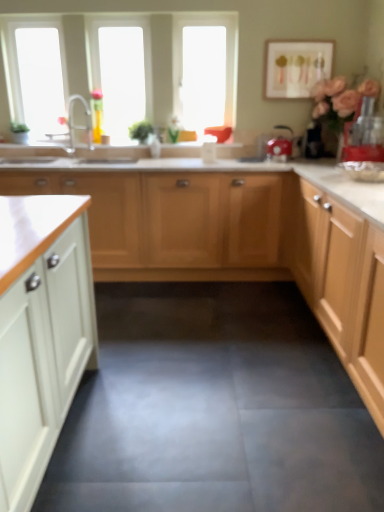
Question: From a real-world perspective, is red plastic blender at right, which appears as the 1th appliance when viewed from the right, located higher than transparent glass window at upper left, which appears as the 2th window screen when viewed from the right?

Choices:
 (A) no
 (B) yes

Answer: (A)

Question: Considering the relative sizes of red plastic blender at right, which appears as the 2th appliance when viewed from the left, and transparent glass window at upper left, which appears as the first window screen when viewed from the left, in the image provided, is red plastic blender at right, which appears as the 2th appliance when viewed from the left, taller than transparent glass window at upper left, which appears as the first window screen when viewed from the left,?

Choices:
 (A) no
 (B) yes

Answer: (A)

Question: Is the position of red plastic blender at right, acting as the second appliance starting from the back, more distant than that of transparent glass window at upper left, which appears as the 2th window screen when viewed from the right?

Choices:
 (A) no
 (B) yes

Answer: (A)

Question: Considering the relative positions of red plastic blender at right, which appears as the 2th appliance when viewed from the left, and transparent glass window at upper left, which appears as the first window screen when viewed from the left, in the image provided, is red plastic blender at right, which appears as the 2th appliance when viewed from the left, to the left of transparent glass window at upper left, which appears as the first window screen when viewed from the left, from the viewer's perspective?

Choices:
 (A) no
 (B) yes

Answer: (A)

Question: From the image's perspective, would you say red plastic blender at right, acting as the second appliance starting from the back, is shown under transparent glass window at upper left, which appears as the 2th window screen when viewed from the right?

Choices:
 (A) yes
 (B) no

Answer: (A)

Question: Could you tell me if red plastic blender at right, which appears as the 1th appliance when viewed from the right, is facing transparent glass window at upper left, which appears as the first window screen when viewed from the left?

Choices:
 (A) yes
 (B) no

Answer: (B)

Question: From a real-world perspective, does red plastic blender at right, which appears as the 2th appliance when viewed from the left, stand above transparent plastic window screen at upper center, the 1th window screen positioned from the right?

Choices:
 (A) no
 (B) yes

Answer: (A)

Question: Considering the relative sizes of red plastic blender at right, acting as the second appliance starting from the back, and transparent plastic window screen at upper center, the second window screen viewed from the left, in the image provided, is red plastic blender at right, acting as the second appliance starting from the back, smaller than transparent plastic window screen at upper center, the second window screen viewed from the left,?

Choices:
 (A) no
 (B) yes

Answer: (B)

Question: Does red plastic blender at right, which appears as the 1th appliance when viewed from the right, have a lesser height compared to transparent plastic window screen at upper center, the 1th window screen positioned from the right?

Choices:
 (A) yes
 (B) no

Answer: (A)

Question: Is red plastic blender at right, which appears as the 1th appliance when viewed from the right, behind transparent plastic window screen at upper center, the second window screen viewed from the left?

Choices:
 (A) yes
 (B) no

Answer: (B)

Question: Is red plastic blender at right, acting as the second appliance starting from the back, facing away from transparent plastic window screen at upper center, the second window screen viewed from the left?

Choices:
 (A) no
 (B) yes

Answer: (A)

Question: Is red plastic blender at right, which appears as the first appliance when viewed from the front, surrounding transparent plastic window screen at upper center, the 1th window screen positioned from the right?

Choices:
 (A) yes
 (B) no

Answer: (B)

Question: Is transparent plastic window screen at upper center, the 1th window screen positioned from the right, taller than red plastic blender at right, which appears as the 1th appliance when viewed from the right?

Choices:
 (A) no
 (B) yes

Answer: (B)